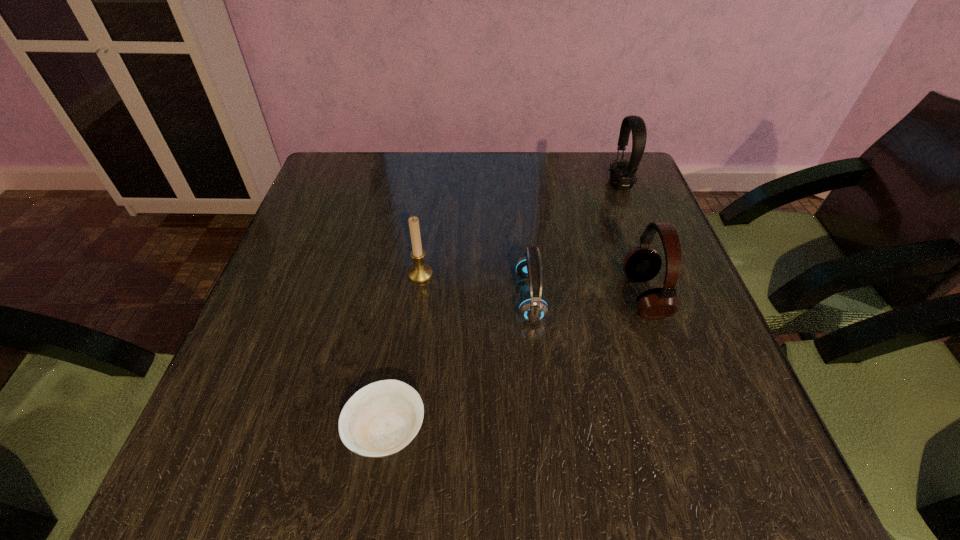
You are a GUI agent. You are given a task and a screenshot of the screen. Output one action in this format:
    pyautogui.click(x=<x>, y=<y>)
    Task: Click on the vacant region at the right edge of the desktop
    
    Given the screenshot: What is the action you would take?
    pyautogui.click(x=668, y=377)

Locate an element on the screen. The width and height of the screenshot is (960, 540). free location at the far right corner of the desktop is located at coordinates (646, 195).

The image size is (960, 540). I want to click on vacant space that is in between the bowl and the candle holder, so click(x=403, y=353).

Identify the location of unoccupied position between the farthest headset and the candle holder. (520, 230).

Where is `free space that is in between the leftmost headset and the bowl`? This screenshot has width=960, height=540. free space that is in between the leftmost headset and the bowl is located at coordinates (458, 364).

The height and width of the screenshot is (540, 960). I want to click on free space that is in between the farthest headset and the second shortest object, so pos(575,241).

In order to click on free spot between the candle holder and the farthest headset in this screenshot , I will do `click(520, 230)`.

Identify the location of vacant space in between the shortest object and the candle holder. (403, 353).

Find the location of a particular element. empty location between the farthest headset and the fourth tallest object is located at coordinates tap(575, 241).

Identify the location of free space between the candle holder and the bowl. This screenshot has width=960, height=540. (x=403, y=353).